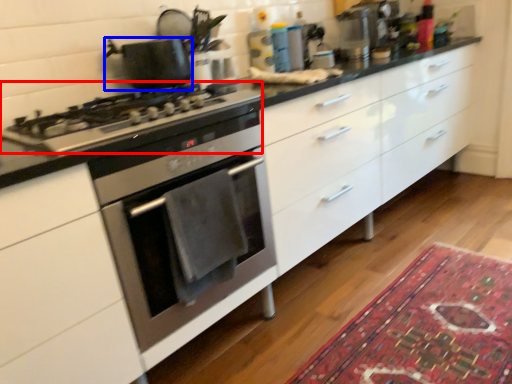
Question: Which point is closer to the camera, gas stove (highlighted by a red box) or kitchen appliance (highlighted by a blue box)?

Choices:
 (A) gas stove
 (B) kitchen appliance

Answer: (A)